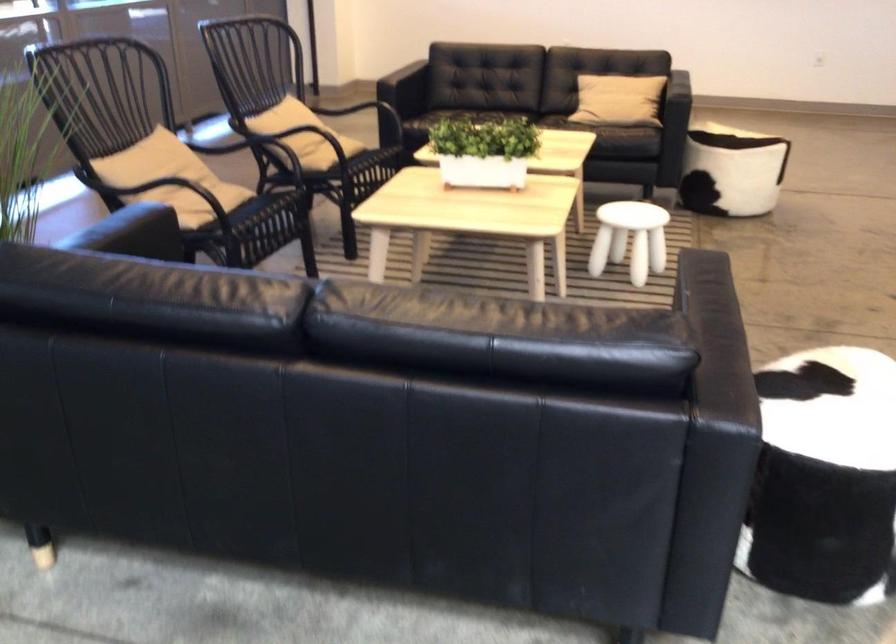
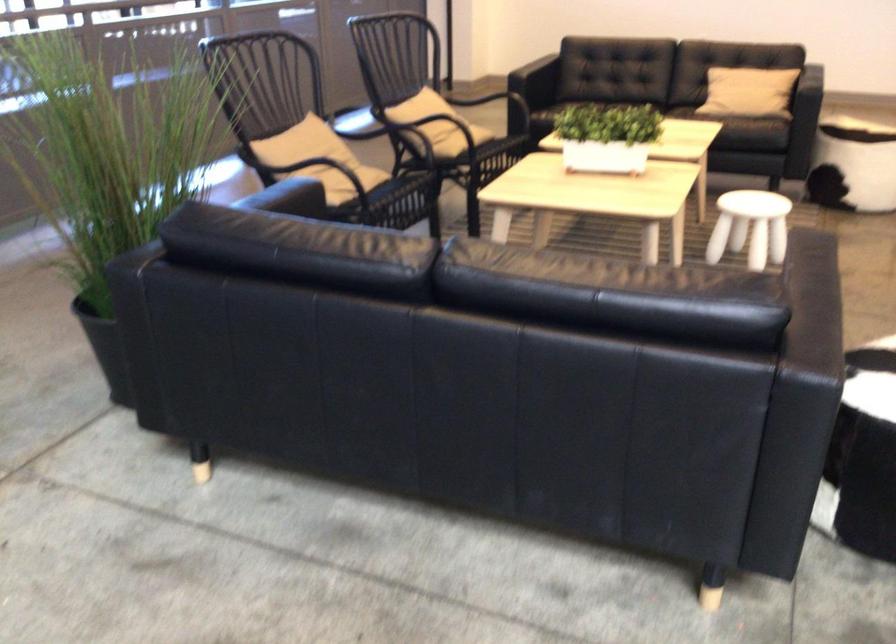
Find the pixel in the second image that matches (x=627, y=238) in the first image.

(750, 227)